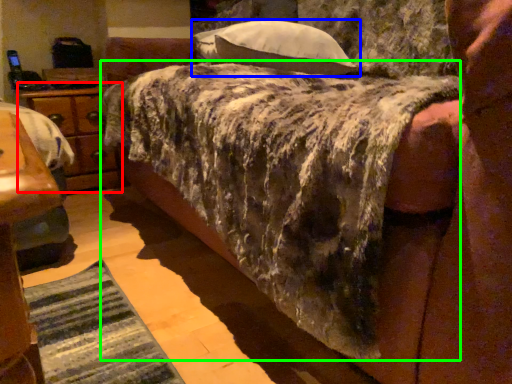
Question: Estimate the real-world distances between objects in this image. Which object is closer to nightstand (highlighted by a red box), pillow (highlighted by a blue box) or mattress (highlighted by a green box)?

Choices:
 (A) pillow
 (B) mattress

Answer: (A)